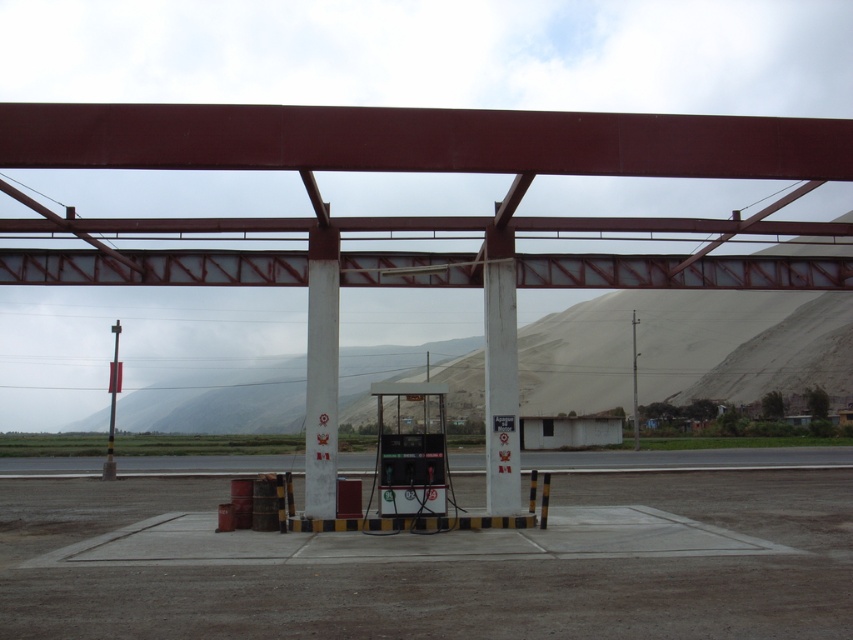
You are driving a truck that is 10 meters long. You need to pass under the smooth red steel overpass at center. Can your truck fit under it if the overpass is higher than the metallic pole at center?

The smooth red steel overpass at center is bigger than metallic pole at center. Since the overpass is higher, your truck can fit under it as long as its height is less than the overpass height.

You are a pilot who just landed a small plane on the gray asphalt runway at lower center. You need to taxi to the white painted concrete pillar at center for refueling. Can you safely move forward towards the pillar without any obstacles?

The white painted concrete pillar at center is behind the gray asphalt runway at lower center, so you can safely taxi forward towards the pillar as there are no obstacles in between according to the scene description.